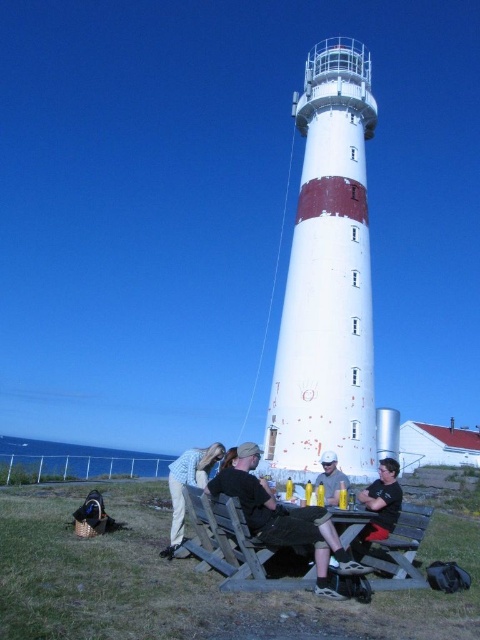
Question: Among these objects, which one is farthest from the camera?

Choices:
 (A) matte black shirt at lower center
 (B) light blue denim shirt at lower center
 (C) wooden picnic table at lower center
 (D) black fabric shirt at lower right

Answer: (A)

Question: Which of these objects is positioned closest to the wooden park bench at lower right?

Choices:
 (A) light blue denim shirt at lower center
 (B) black fabric shirt at lower right
 (C) black cotton shirt at lower center
 (D) wooden picnic table at lower center

Answer: (B)

Question: Can you confirm if light blue denim shirt at lower center is positioned to the left of matte black shirt at lower center?

Choices:
 (A) yes
 (B) no

Answer: (A)

Question: Which of the following is the farthest from the observer?

Choices:
 (A) light blue denim shirt at lower center
 (B) wooden picnic table at lower center

Answer: (A)

Question: In this image, where is wooden picnic table at lower center located relative to black fabric shirt at lower right?

Choices:
 (A) left
 (B) right

Answer: (A)

Question: Is wooden picnic table at lower center bigger than light blue denim shirt at lower center?

Choices:
 (A) no
 (B) yes

Answer: (A)